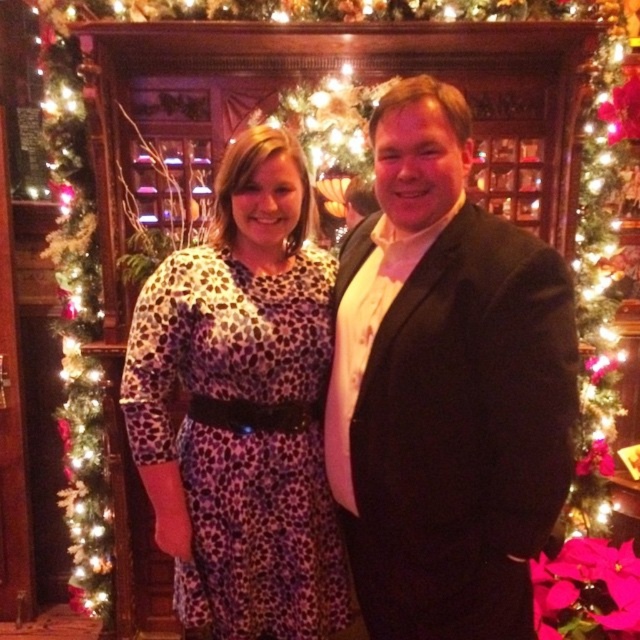
Question: Does leopard print fabric dress at center appear on the left side of green garland at left?

Choices:
 (A) no
 (B) yes

Answer: (A)

Question: Does leopard print fabric dress at center have a smaller size compared to green garland at left?

Choices:
 (A) yes
 (B) no

Answer: (A)

Question: Which point is farther to the camera?

Choices:
 (A) (595, 472)
 (B) (448, 385)

Answer: (A)

Question: Does leopard print fabric dress at center have a greater width compared to green artificial christmas tree at left?

Choices:
 (A) yes
 (B) no

Answer: (A)

Question: Which point is farther to the camera?

Choices:
 (A) green garland at left
 (B) leopard print fabric dress at center
 (C) green artificial christmas tree at left
 (D) black satin suit at center

Answer: (C)

Question: Which point is farther from the camera taking this photo?

Choices:
 (A) (230, 596)
 (B) (337, 356)

Answer: (A)